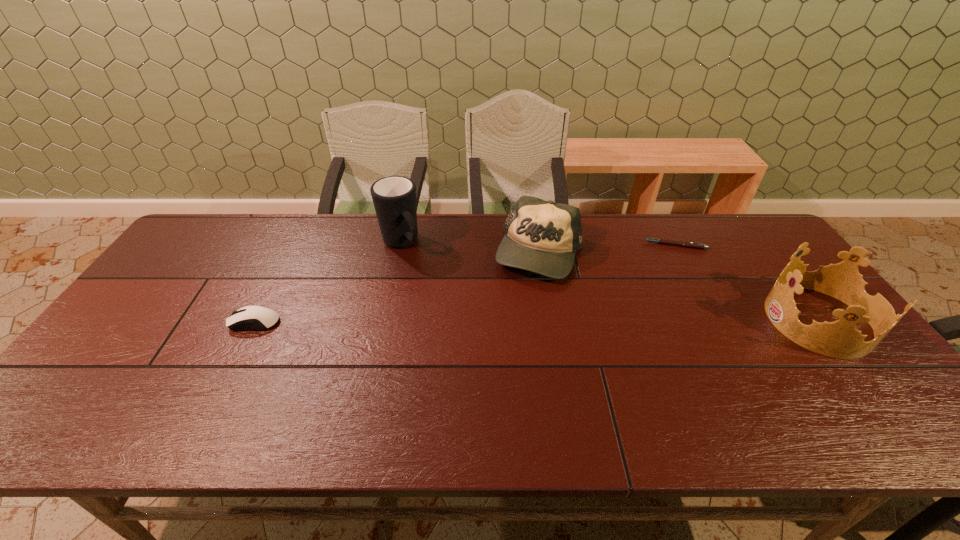
I want to click on mouse, so click(250, 317).

Identify the location of the second shortest object. (250, 317).

Image resolution: width=960 pixels, height=540 pixels. What are the coordinates of `the rightmost object` in the screenshot? It's located at coord(840,339).

Locate an element on the screen. the shortest object is located at coordinates (663, 241).

Locate an element on the screen. This screenshot has width=960, height=540. pen is located at coordinates (663, 241).

You are a GUI agent. You are given a task and a screenshot of the screen. Output one action in this format:
    pyautogui.click(x=<x>, y=<y>)
    Task: Click on the baseball cap
    
    Given the screenshot: What is the action you would take?
    pyautogui.click(x=541, y=236)

Where is `the third object from right to left`? the third object from right to left is located at coordinates pos(541,236).

In order to click on mug in this screenshot , I will do `click(394, 197)`.

You are a GUI agent. You are given a task and a screenshot of the screen. Output one action in this format:
    pyautogui.click(x=<x>, y=<y>)
    Task: Click on the free space located on the left of the leftmost object
    
    Given the screenshot: What is the action you would take?
    pyautogui.click(x=140, y=322)

This screenshot has height=540, width=960. Identify the location of blank space located 0.110m on the front-facing side of the rightmost object. (729, 320).